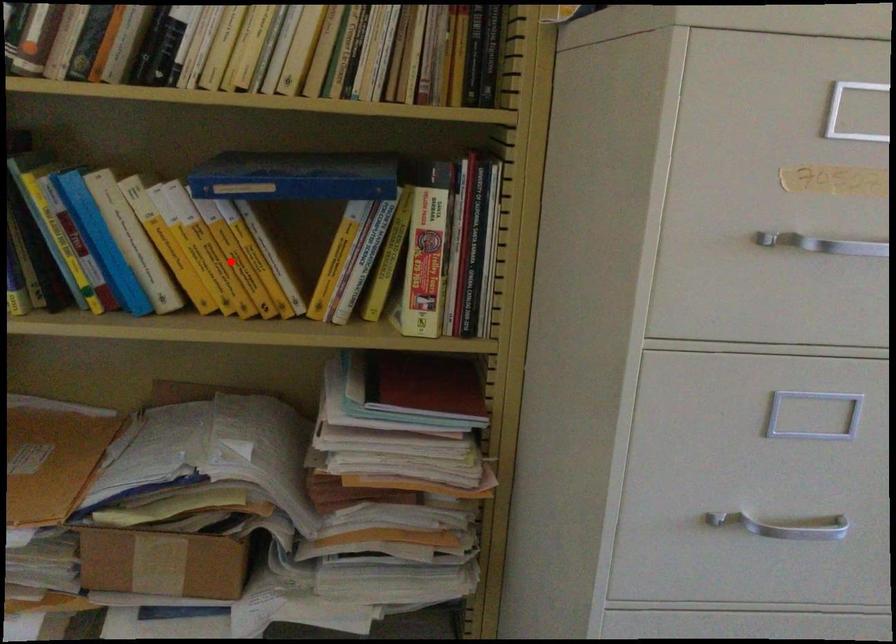
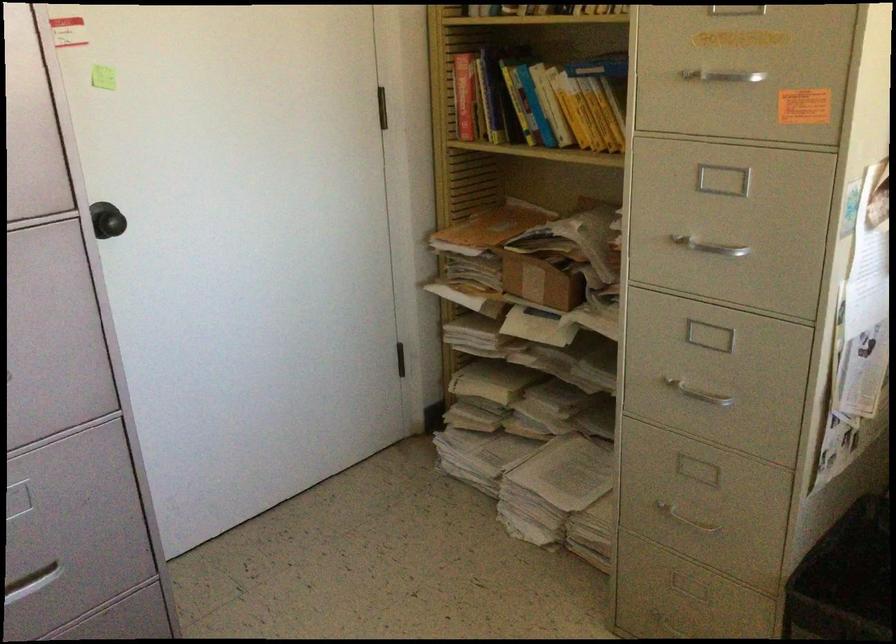
Question: I am providing you with two images of the same scene from different viewpoints. Given a red point in image1, look at the same physical point in image2. Is it:

Choices:
 (A) Closer to the viewpoint
 (B) Farther from the viewpoint

Answer: (B)